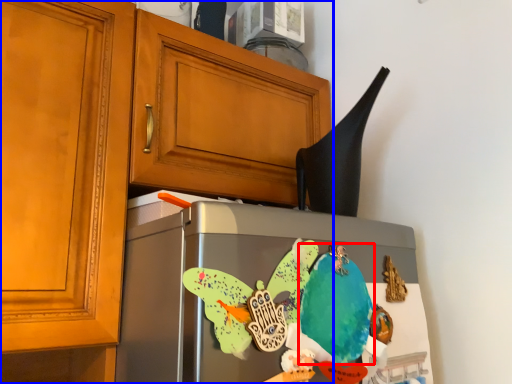
Question: Which of the following is the closest to the observer, parrot (highlighted by a red box) or cabinetry (highlighted by a blue box)?

Choices:
 (A) parrot
 (B) cabinetry

Answer: (B)